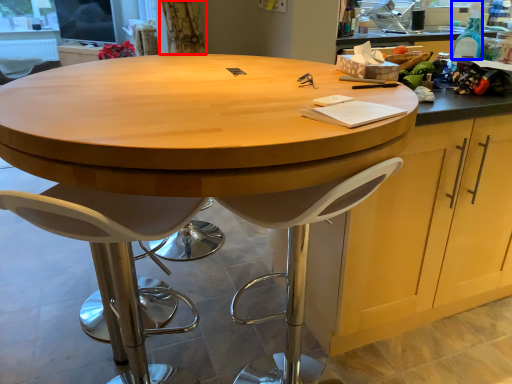
Question: Among these objects, which one is nearest to the camera, curtain (highlighted by a red box) or bottle (highlighted by a blue box)?

Choices:
 (A) curtain
 (B) bottle

Answer: (B)